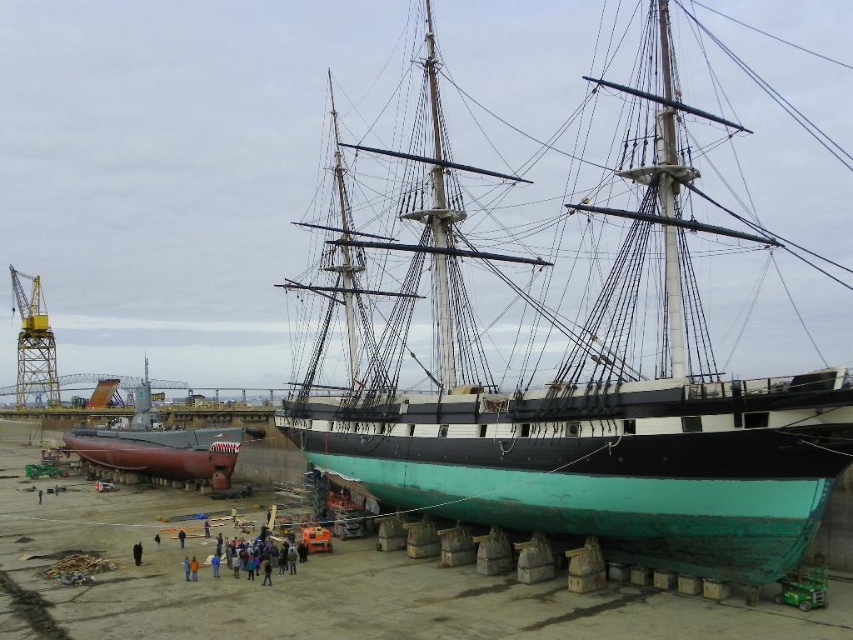
You are a photographer standing at the edge of the dock. You want to take a photo of the teal matte ship at center without any people in the frame. Given their positions, can you position yourself so that the dark blue jeans at lower center are not blocking the view of the ship?

The teal matte ship at center is in front of dark blue jeans at lower center, so if you position yourself behind the ship, the dark blue jeans at lower center will be behind you and not block the view of the ship.

You are standing at point (x=155, y=451) and want to walk to point (x=53, y=387). Which direction should you move relative to the ship?

You should move backward relative to the ship because point (x=155, y=451) is in front of point (x=53, y=387).